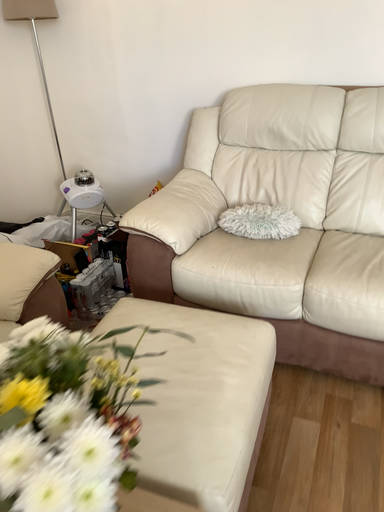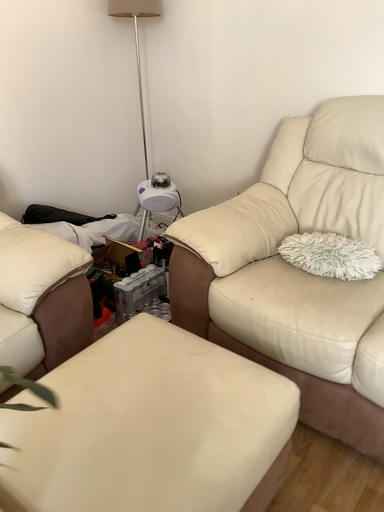
Question: How did the camera likely rotate when shooting the video?

Choices:
 (A) rotated right
 (B) rotated left

Answer: (B)